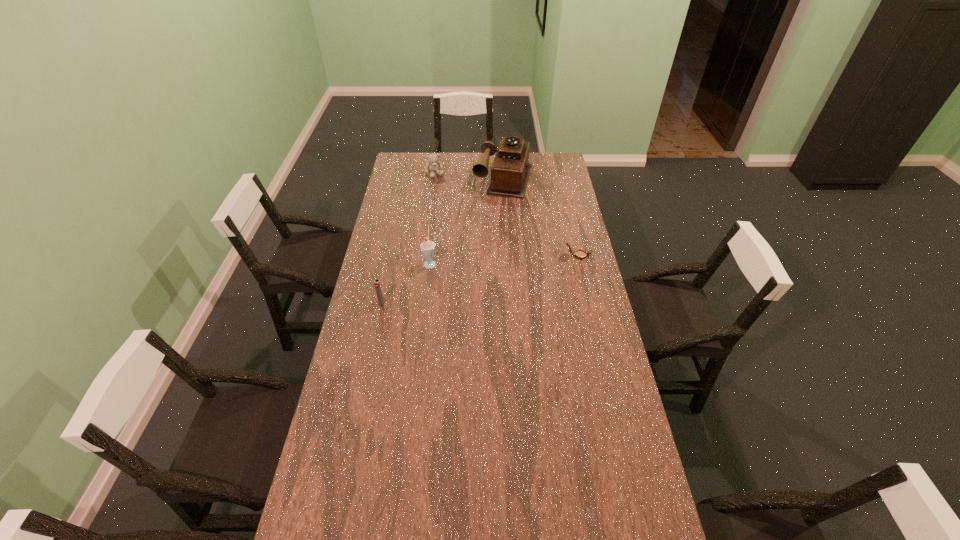
Locate an element on the screen. Image resolution: width=960 pixels, height=540 pixels. vacant space located on the straw side of the milkshake is located at coordinates (458, 272).

What are the coordinates of `free region located 0.090m on the straw side of the milkshake` in the screenshot? It's located at (456, 271).

Where is `vacant space situated 0.070m on the horn of the second object from right to left`? The height and width of the screenshot is (540, 960). vacant space situated 0.070m on the horn of the second object from right to left is located at coordinates (495, 206).

The width and height of the screenshot is (960, 540). What are the coordinates of `vacant region located on the horn of the second object from right to left` in the screenshot? It's located at (492, 217).

The width and height of the screenshot is (960, 540). I want to click on vacant space located on the horn of the second object from right to left, so click(482, 249).

Find the location of a particular element. The width and height of the screenshot is (960, 540). vacant space located on the face of the teddy bear is located at coordinates (455, 211).

Image resolution: width=960 pixels, height=540 pixels. Find the location of `free space located 0.300m on the face of the teddy bear`. free space located 0.300m on the face of the teddy bear is located at coordinates (455, 212).

The width and height of the screenshot is (960, 540). What are the coordinates of `vacant region located 0.250m on the face of the teddy bear` in the screenshot? It's located at (452, 206).

In order to click on phonograph_record at the far edge in this screenshot , I will do `click(510, 171)`.

Locate an element on the screen. The height and width of the screenshot is (540, 960). teddy bear that is at the far edge is located at coordinates (432, 166).